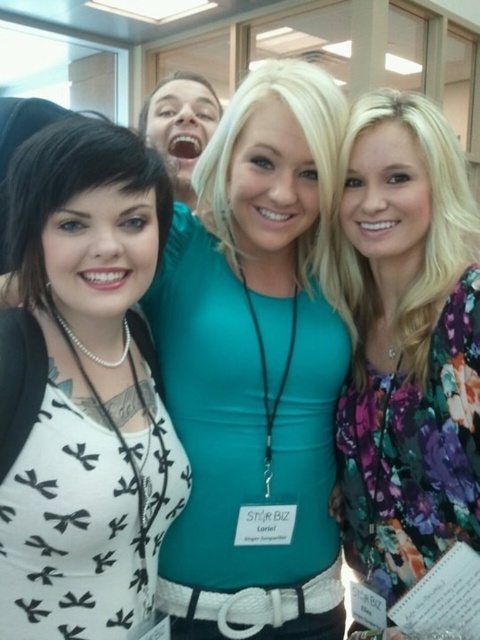
You are taking a photo of the group and want to focus on the person at point (208, 356) and the person at point (360, 310). Which of these two points is closer to the camera?

Point (208, 356) is closer to the camera than point (360, 310).